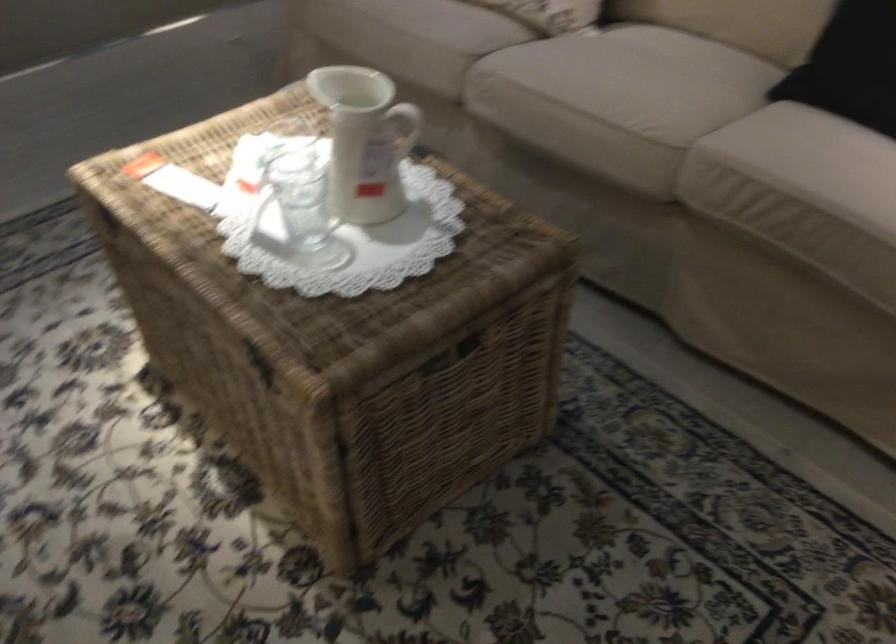
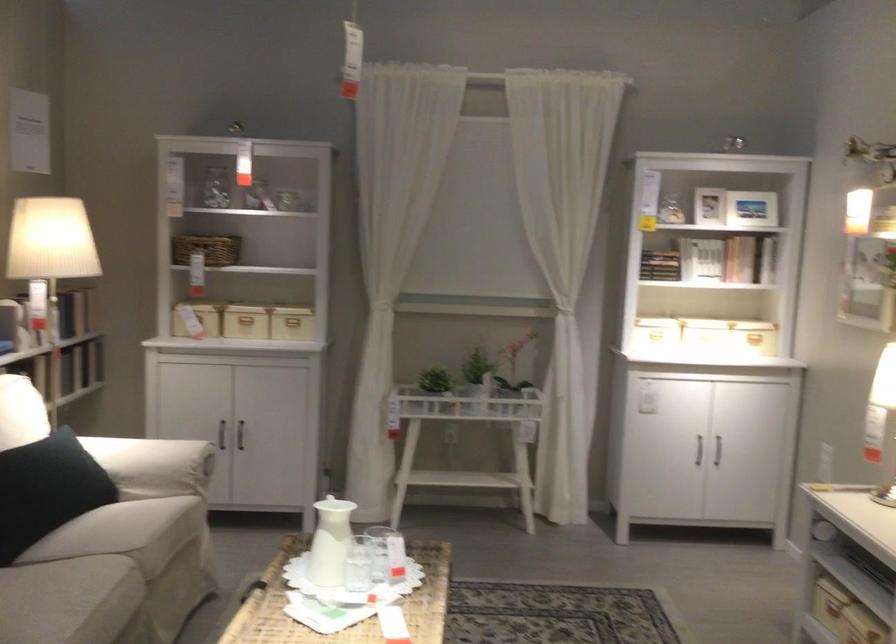
Locate, in the second image, the point that corresponds to pixel 658 120 in the first image.

(110, 576)